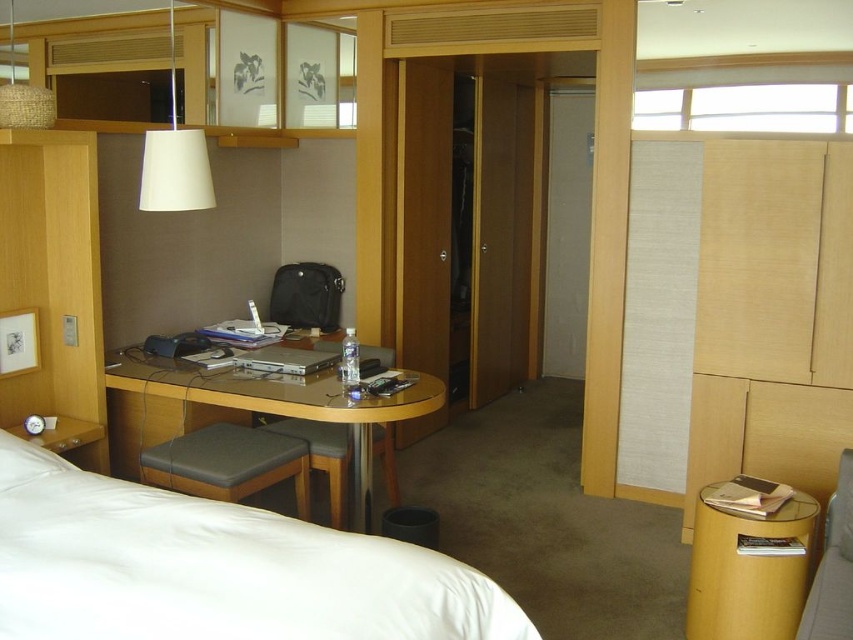
Does white smooth bed at lower left have a lesser height compared to matte gray cushioned chair at lower right?

In fact, white smooth bed at lower left may be taller than matte gray cushioned chair at lower right.

Does point (74, 628) lie behind point (822, 614)?

No, it is not.

Is point (474, 596) behind point (810, 588)?

No.

At what (x,y) coordinates should I click in order to perform the action: click on white smooth bed at lower left. Please return your answer as a coordinate pair (x, y). The width and height of the screenshot is (853, 640). Looking at the image, I should click on (213, 568).

Is dark gray leather stool at lower center wider than matte gray cushioned stool at center?

Indeed, dark gray leather stool at lower center has a greater width compared to matte gray cushioned stool at center.

Is the position of dark gray leather stool at lower center more distant than that of matte gray cushioned stool at center?

No.

Which is in front, point (248, 486) or point (277, 420)?

Point (248, 486) is more forward.

Identify the location of dark gray leather stool at lower center. The width and height of the screenshot is (853, 640). (228, 464).

Which of these two, white smooth bed at lower left or wooden polished table at center, stands taller?

With more height is wooden polished table at center.

Is the position of white smooth bed at lower left more distant than that of wooden polished table at center?

No, white smooth bed at lower left is in front of wooden polished table at center.

Is point (380, 576) closer to viewer compared to point (439, 384)?

Yes, it is.

Locate an element on the screen. This screenshot has height=640, width=853. white smooth bed at lower left is located at coordinates (213, 568).